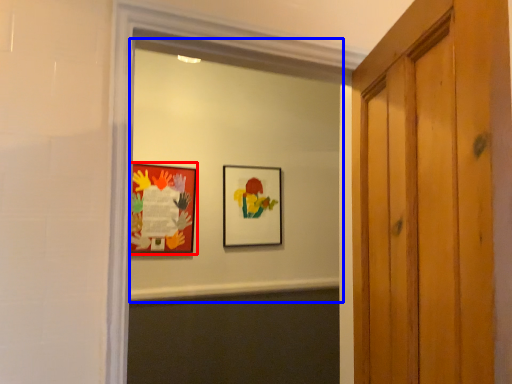
Question: Which of the following is the closest to the observer, picture frame (highlighted by a red box) or mirror (highlighted by a blue box)?

Choices:
 (A) picture frame
 (B) mirror

Answer: (B)